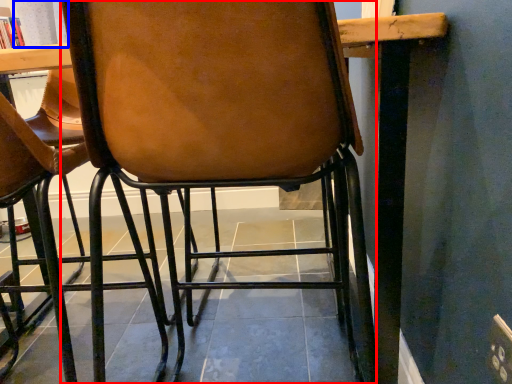
Question: Which point is further to the camera, chair (highlighted by a red box) or curtain (highlighted by a blue box)?

Choices:
 (A) chair
 (B) curtain

Answer: (B)